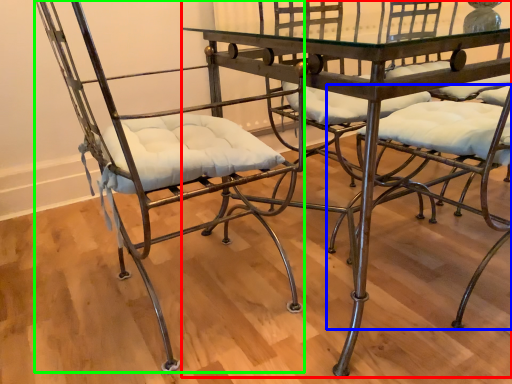
Question: Estimate the real-world distances between objects in this image. Which object is closer to table (highlighted by a red box), chair (highlighted by a blue box) or chair (highlighted by a green box)?

Choices:
 (A) chair
 (B) chair

Answer: (A)